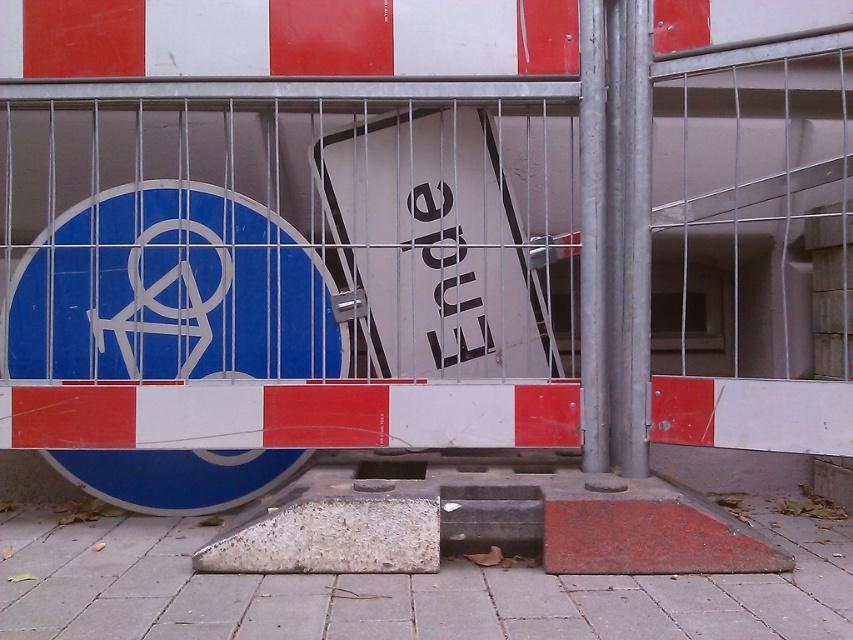
Which is more to the left, concrete pavement at center or white matte sign at center?

From the viewer's perspective, concrete pavement at center appears more on the left side.

Does concrete pavement at center appear over white matte sign at center?

Actually, concrete pavement at center is below white matte sign at center.

Between point (154, 630) and point (422, 150), which one is positioned in front?

Point (154, 630)

Identify the location of concrete pavement at center. (415, 577).